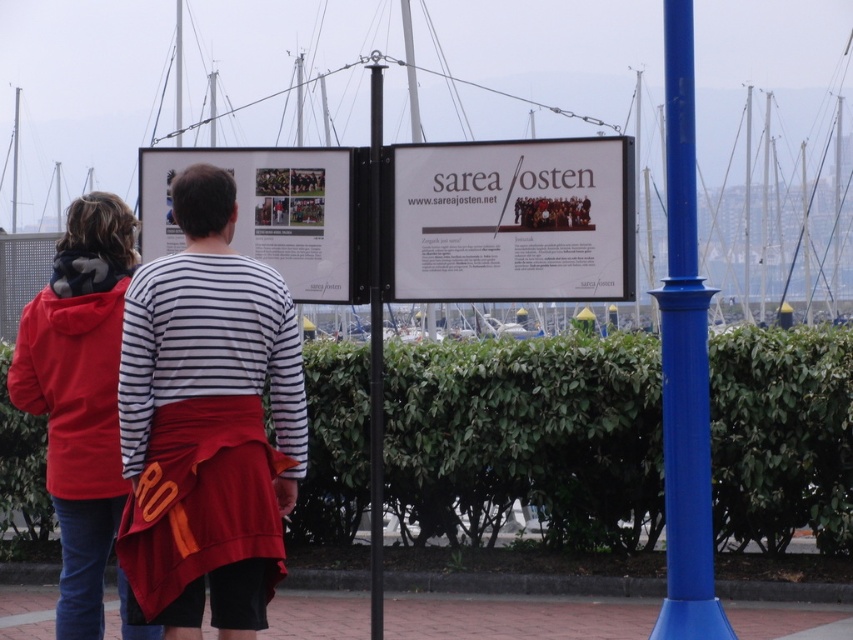
Question: Which object is the closest to the red fleece jacket at left?

Choices:
 (A) white glossy signboard at center
 (B) green leafy hedge at center

Answer: (A)

Question: Considering the relative positions of blue glossy pole at right and white glossy signboard at center in the image provided, where is blue glossy pole at right located with respect to white glossy signboard at center?

Choices:
 (A) left
 (B) right

Answer: (B)

Question: Is green leafy hedge at center behind black metal pole at center?

Choices:
 (A) yes
 (B) no

Answer: (A)

Question: Does white paper signage at center come behind white glossy signboard at center?

Choices:
 (A) yes
 (B) no

Answer: (B)

Question: Based on their relative distances, which object is nearer to the black metal pole at center?

Choices:
 (A) blue glossy pole at right
 (B) white glossy signboard at center
 (C) matte striped shirt at center

Answer: (B)

Question: Which of the following is the closest to the observer?

Choices:
 (A) (665, 486)
 (B) (183, 604)

Answer: (B)